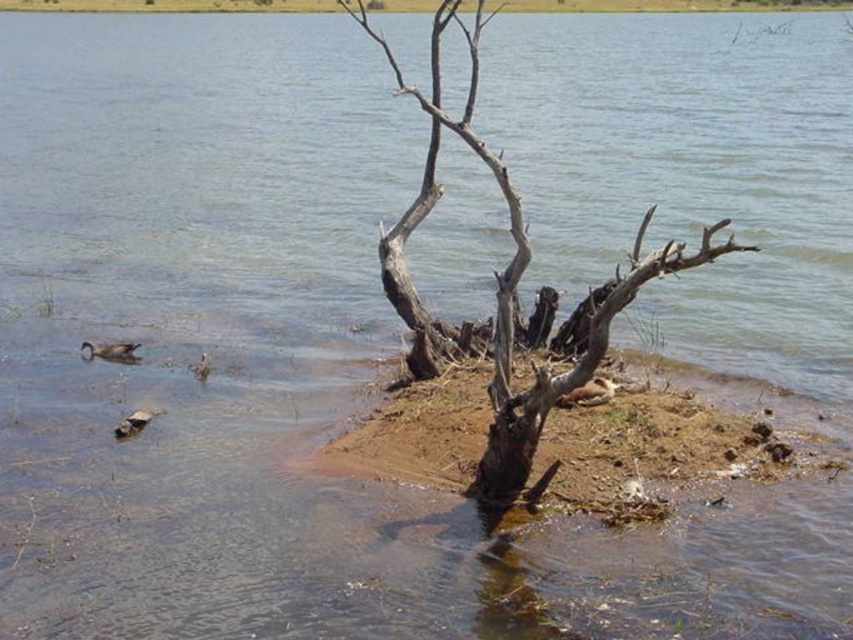
Question: Which object is the farthest from the brown feathered duck at center?

Choices:
 (A) brown dirt shoreline at center
 (B) dead wood tree at center
 (C) brown fuzzy duck at lower left

Answer: (A)

Question: Which of the following is the farthest from the observer?

Choices:
 (A) dead wood tree at center
 (B) brown dirt shoreline at center
 (C) brown fuzzy duck at lower left
 (D) brown matte duck at lower left

Answer: (D)

Question: Can you confirm if dead wood tree at center is smaller than brown feathered duck at center?

Choices:
 (A) no
 (B) yes

Answer: (A)

Question: Does brown matte duck at lower left have a smaller size compared to brown fuzzy duck at lower left?

Choices:
 (A) no
 (B) yes

Answer: (A)

Question: Does brown matte duck at lower left appear over brown feathered duck at center?

Choices:
 (A) no
 (B) yes

Answer: (B)

Question: Estimate the real-world distances between objects in this image. Which object is closer to the dead wood tree at center?

Choices:
 (A) brown feathered duck at center
 (B) brown dirt shoreline at center
 (C) brown fuzzy duck at lower left
 (D) brown matte duck at lower left

Answer: (B)